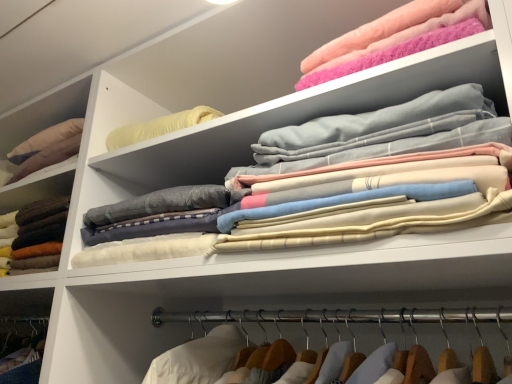
Question: Does point (12, 213) appear closer or farther from the camera than point (406, 218)?

Choices:
 (A) farther
 (B) closer

Answer: (A)

Question: Is soft wool sweater at left, placed as the 1th clothing when sorted from left to right, wider or thinner than soft cotton sheets at upper center, the 2th clothing when ordered from left to right?

Choices:
 (A) thin
 (B) wide

Answer: (B)

Question: Considering the real-world distances, which object is farthest from the fluffy pink towel at upper right, arranged as the 1th clothing when viewed from the right?

Choices:
 (A) soft cotton sheets at upper center, the 2th clothing when ordered from left to right
 (B) soft wool sweater at left, which is the 3th clothing from right to left

Answer: (B)

Question: Which object is positioned closest to the soft cotton sheets at upper center, marked as the 2th clothing in a right-to-left arrangement?

Choices:
 (A) fluffy pink towel at upper right, arranged as the 1th clothing when viewed from the right
 (B) soft wool sweater at left, placed as the 1th clothing when sorted from left to right

Answer: (A)